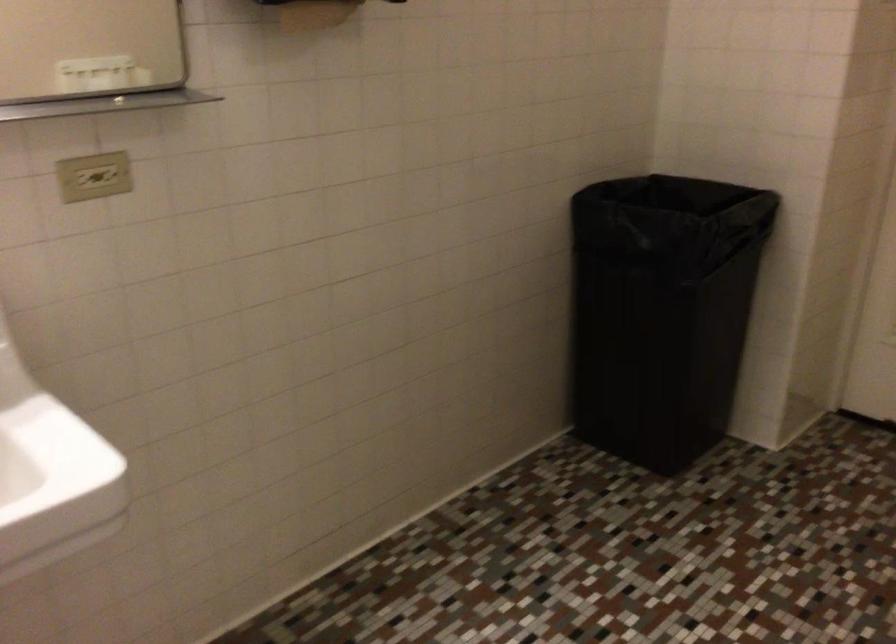
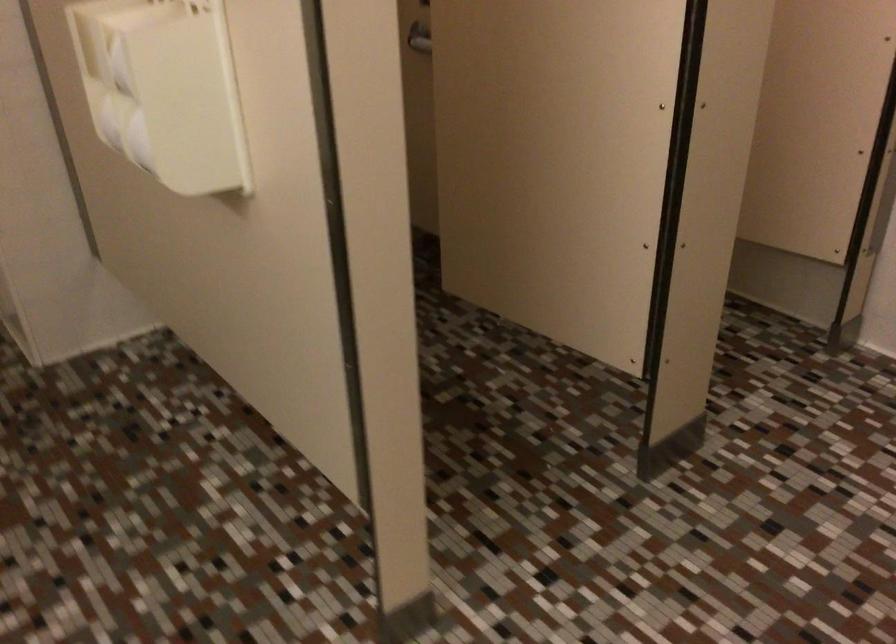
The first image is from the beginning of the video and the second image is from the end. How did the camera likely rotate when shooting the video?

The rotation direction of the camera is right-down.